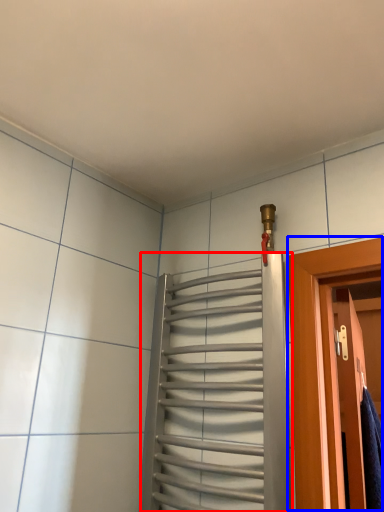
Question: Which object appears farthest to the camera in this image, elevator (highlighted by a red box) or door (highlighted by a blue box)?

Choices:
 (A) elevator
 (B) door

Answer: (B)